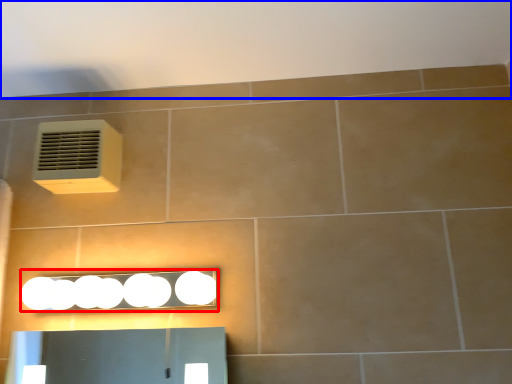
Question: Which object appears farthest to the camera in this image, light fixture (highlighted by a red box) or backdrop (highlighted by a blue box)?

Choices:
 (A) light fixture
 (B) backdrop

Answer: (A)